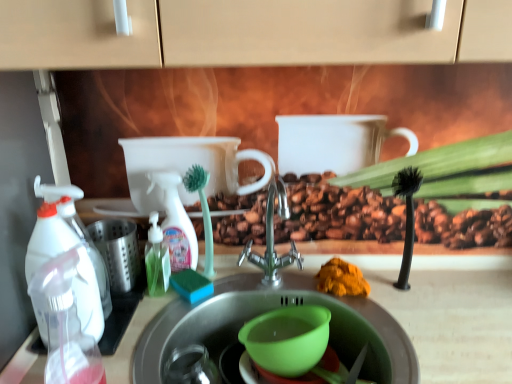
What are the coordinates of `vacant space underneath satin nickel faucet at center (from a real-world perspective)` in the screenshot? It's located at (276, 283).